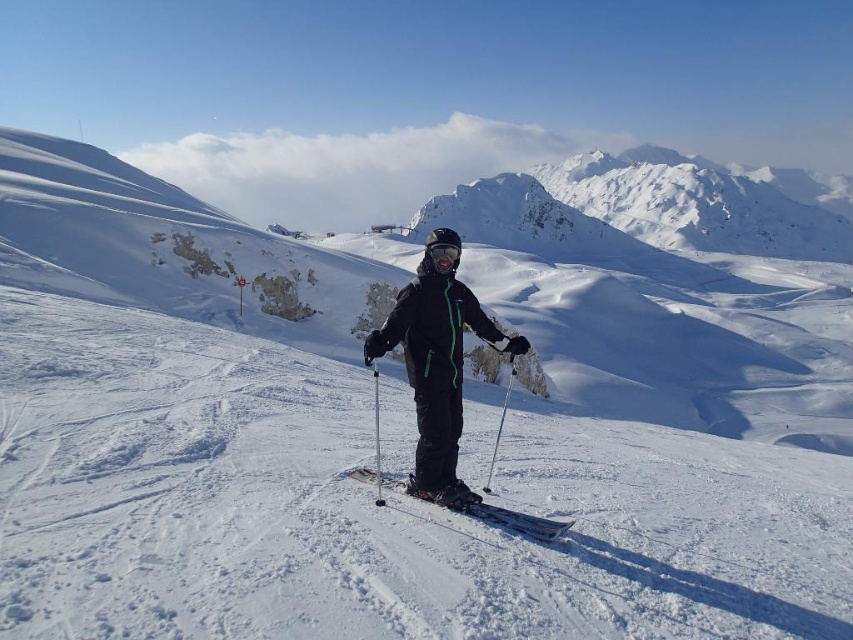
Is shiny metallic skis at center shorter than black matte goggles at center?

Indeed, shiny metallic skis at center has a lesser height compared to black matte goggles at center.

Can you confirm if shiny metallic skis at center is positioned above black matte goggles at center?

Actually, shiny metallic skis at center is below black matte goggles at center.

Where is `shiny metallic skis at center`? The height and width of the screenshot is (640, 853). shiny metallic skis at center is located at coordinates click(x=517, y=520).

Based on the photo, who is shorter, snowy granite mountain at upper center or black matte goggles at center?

black matte goggles at center

Is snowy granite mountain at upper center above black matte goggles at center?

Yes, snowy granite mountain at upper center is above black matte goggles at center.

Locate an element on the screen. This screenshot has height=640, width=853. snowy granite mountain at upper center is located at coordinates (637, 211).

Does snowy granite mountain at upper center have a greater height compared to metallic silver ski pole at center?

Correct, snowy granite mountain at upper center is much taller as metallic silver ski pole at center.

Is point (505, 220) positioned before point (379, 458)?

No, (505, 220) is behind (379, 458).

In order to click on snowy granite mountain at upper center in this screenshot , I will do `click(637, 211)`.